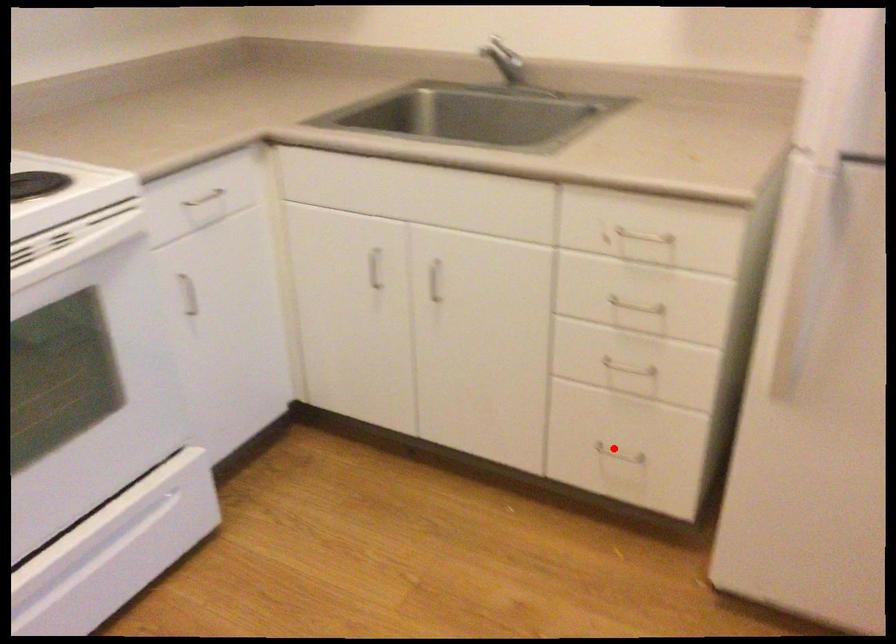
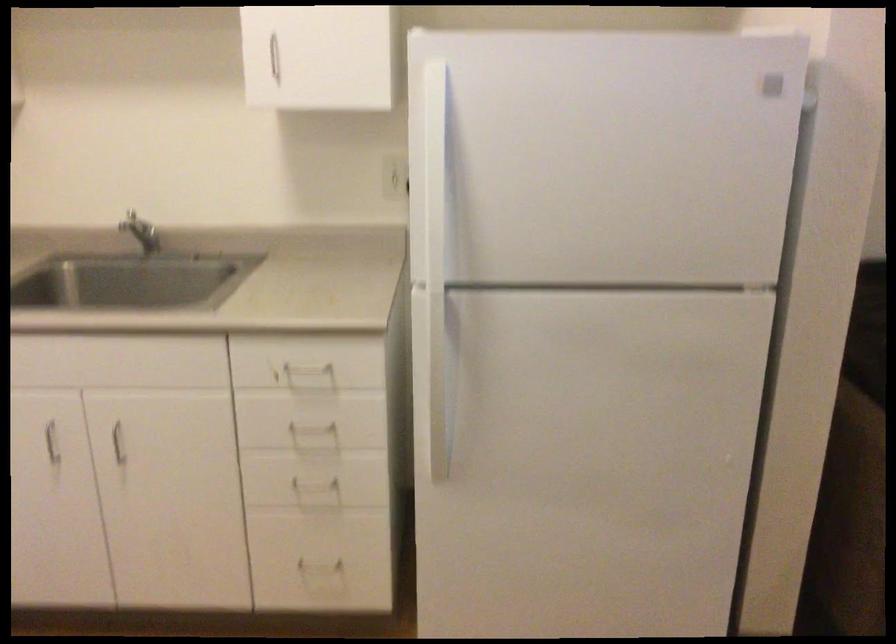
Where in the second image is the point corresponding to the highlighted location from the first image?

(317, 560)